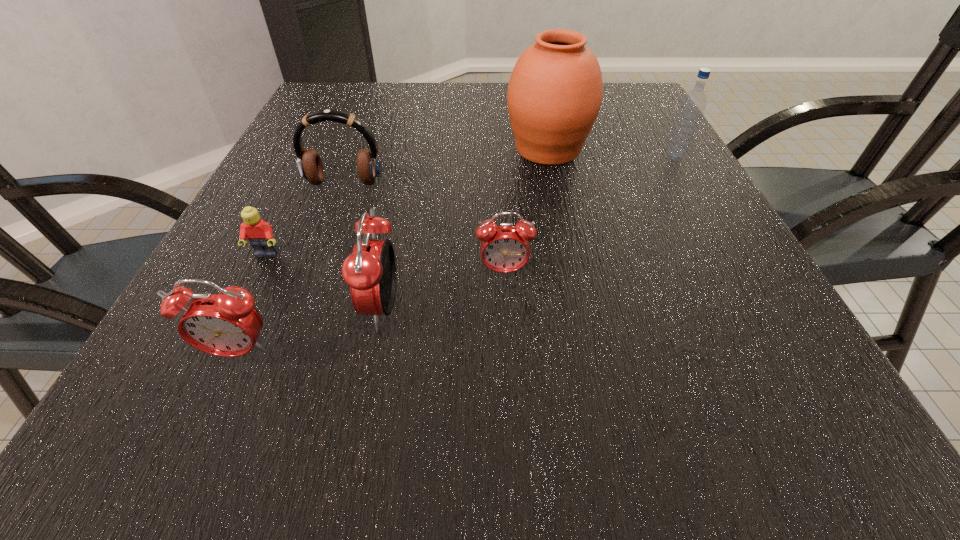
Please point a vacant point for placing a alarm clock on the right. Please provide its 2D coordinates. Your answer should be formatted as a tuple, i.e. [(x, y)], where the tuple contains the x and y coordinates of a point satisfying the conditions above.

[(609, 240)]